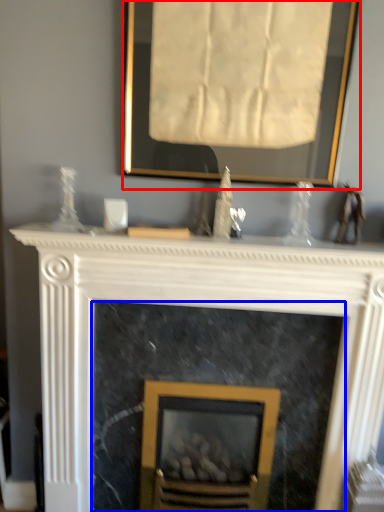
Question: Which object is closer to the camera taking this photo, picture frame (highlighted by a red box) or fireplace (highlighted by a blue box)?

Choices:
 (A) picture frame
 (B) fireplace

Answer: (A)